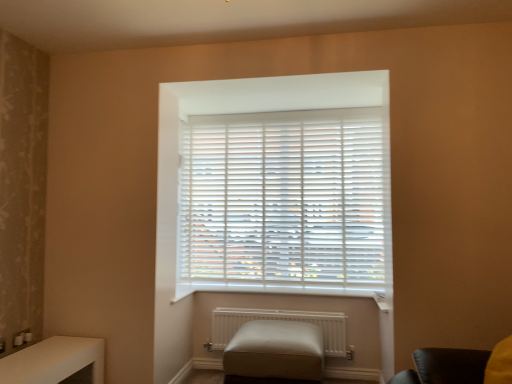
Image resolution: width=512 pixels, height=384 pixels. What do you see at coordinates (280, 319) in the screenshot?
I see `white matte radiator at lower center` at bounding box center [280, 319].

This screenshot has height=384, width=512. Describe the element at coordinates (275, 353) in the screenshot. I see `beige leather ottoman at center` at that location.

Find the location of a particular element. Image resolution: width=512 pixels, height=384 pixels. white matte blinds at center is located at coordinates (286, 201).

Find the location of a particular element. window blind on the right of beige leather ottoman at center is located at coordinates (286, 201).

From the picture: Can you confirm if beige leather ottoman at center is positioned to the left of white matte blinds at center?

Correct, you'll find beige leather ottoman at center to the left of white matte blinds at center.

How far apart are beige leather ottoman at center and white matte blinds at center?

beige leather ottoman at center is 38.62 inches from white matte blinds at center.

From a real-world perspective, which is physically above, beige leather ottoman at center or white matte blinds at center?

white matte blinds at center, from a real-world perspective.

This screenshot has height=384, width=512. What are the coordinates of `window blind that is on the right side of white matte radiator at lower center` in the screenshot? It's located at (286, 201).

Which object is closer to the camera taking this photo, white matte radiator at lower center or white matte blinds at center?

Positioned in front is white matte radiator at lower center.

Is white matte radiator at lower center inside the boundaries of white matte blinds at center, or outside?

white matte radiator at lower center is not inside white matte blinds at center, it's outside.

Is white matte radiator at lower center aimed at white matte blinds at center?

No, white matte radiator at lower center is not aimed at white matte blinds at center.

From the image's perspective, between white glossy table at lower left and white matte blinds at center, who is located below?

white glossy table at lower left appears lower in the image.

Looking at this image, which object is closer to the camera taking this photo, white glossy table at lower left or white matte blinds at center?

white glossy table at lower left is closer to the camera.

Are white glossy table at lower left and white matte blinds at center far apart?

white glossy table at lower left is far away from white matte blinds at center.

How many degrees apart are the facing directions of white glossy table at lower left and white matte blinds at center?

There is a 90-degree angle between the facing directions of white glossy table at lower left and white matte blinds at center.

Is white matte blinds at center outside of white glossy table at lower left?

Yes, white matte blinds at center is outside of white glossy table at lower left.

Can you confirm if white matte blinds at center is shorter than white glossy table at lower left?

No, white matte blinds at center is not shorter than white glossy table at lower left.

Identify the location of table that appears in front of the white matte blinds at center. This screenshot has width=512, height=384. (54, 361).

Based on their sizes in the image, would you say beige leather ottoman at center is bigger or smaller than white glossy table at lower left?

beige leather ottoman at center is bigger than white glossy table at lower left.

Looking at this image, can you confirm if beige leather ottoman at center is shorter than white glossy table at lower left?

No, beige leather ottoman at center is not shorter than white glossy table at lower left.

From a real-world perspective, between beige leather ottoman at center and white glossy table at lower left, who is vertically lower?

In real-world perspective, beige leather ottoman at center is lower.

Is the depth of beige leather ottoman at center greater than that of white glossy table at lower left?

Yes, beige leather ottoman at center is further from the viewer.

Does point (97, 357) appear closer or farther from the camera than point (309, 318)?

Point (97, 357) appears to be closer to the viewer than point (309, 318).

Does white glossy table at lower left appear on the right side of white matte radiator at lower center?

No, white glossy table at lower left is not to the right of white matte radiator at lower center.

Considering the positions of objects white glossy table at lower left and white matte radiator at lower center in the image provided, who is in front, white glossy table at lower left or white matte radiator at lower center?

white glossy table at lower left is more forward.

Is beige leather ottoman at center facing away from white matte radiator at lower center?

Yes, beige leather ottoman at center is positioned with its back facing white matte radiator at lower center.

Considering the positions of objects beige leather ottoman at center and white matte radiator at lower center in the image provided, who is more to the right, beige leather ottoman at center or white matte radiator at lower center?

white matte radiator at lower center.

From the image's perspective, which object appears higher, beige leather ottoman at center or white matte radiator at lower center?

A: white matte radiator at lower center appears higher in the image.

Does beige leather ottoman at center have a smaller size compared to white matte radiator at lower center?

Incorrect, beige leather ottoman at center is not smaller in size than white matte radiator at lower center.

Identify the location of furniture below the white matte blinds at center (from the image's perspective). This screenshot has width=512, height=384. (275, 353).

What are the coordinates of `radiator below the white matte blinds at center (from a real-world perspective)` in the screenshot? It's located at (280, 319).

Based on the photo, looking at the image, which one is located closer to white glossy table at lower left, beige leather ottoman at center or white matte blinds at center?

The object closer to white glossy table at lower left is beige leather ottoman at center.

Estimate the real-world distances between objects in this image. Which object is further from beige leather ottoman at center, white matte radiator at lower center or white glossy table at lower left?

white glossy table at lower left is positioned further to the anchor beige leather ottoman at center.

Considering their positions, is white glossy table at lower left positioned further to white matte radiator at lower center than white matte blinds at center?

Based on the image, white glossy table at lower left appears to be further to white matte radiator at lower center.

Consider the image. Looking at the image, which one is located further to white glossy table at lower left, white matte blinds at center or white matte radiator at lower center?

white matte blinds at center.

Estimate the real-world distances between objects in this image. Which object is further from white matte blinds at center, beige leather ottoman at center or white glossy table at lower left?

Based on the image, white glossy table at lower left appears to be further to white matte blinds at center.

From the picture: Considering their positions, is white glossy table at lower left positioned closer to white matte blinds at center than beige leather ottoman at center?

beige leather ottoman at center.

From the image, which object appears to be farther from white glossy table at lower left, beige leather ottoman at center or white matte radiator at lower center?

The object further to white glossy table at lower left is white matte radiator at lower center.

When comparing their distances from white matte blinds at center, does white matte radiator at lower center or white glossy table at lower left seem closer?

The object closer to white matte blinds at center is white matte radiator at lower center.

Locate an element on the screen. Image resolution: width=512 pixels, height=384 pixels. furniture between white glossy table at lower left and white matte radiator at lower center from left to right is located at coordinates (275, 353).

Find the location of a particular element. Image resolution: width=512 pixels, height=384 pixels. radiator between white matte blinds at center and beige leather ottoman at center vertically is located at coordinates (280, 319).

Where is `radiator between white glossy table at lower left and white matte blinds at center`? radiator between white glossy table at lower left and white matte blinds at center is located at coordinates [x=280, y=319].

Find the location of a particular element. The width and height of the screenshot is (512, 384). furniture situated between white glossy table at lower left and white matte blinds at center from left to right is located at coordinates (275, 353).